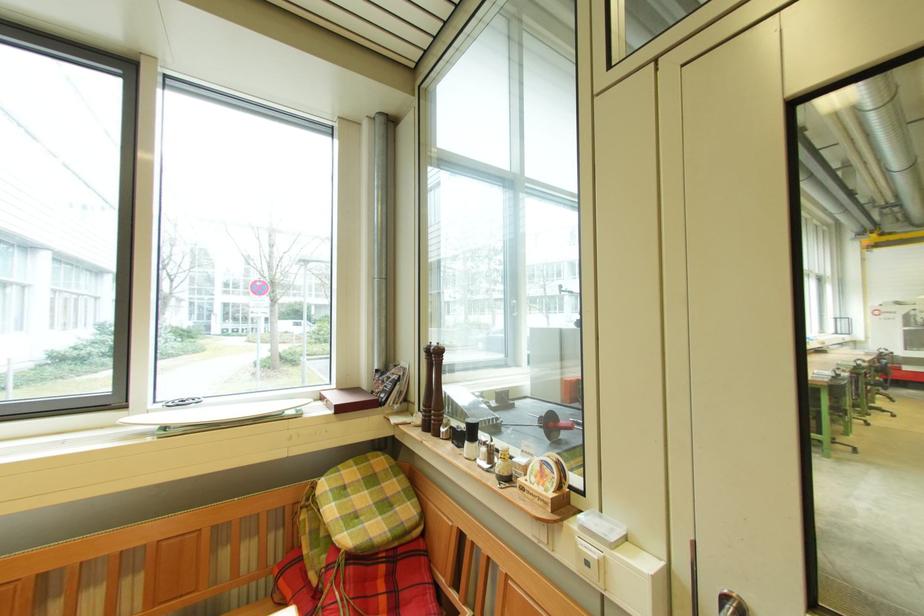
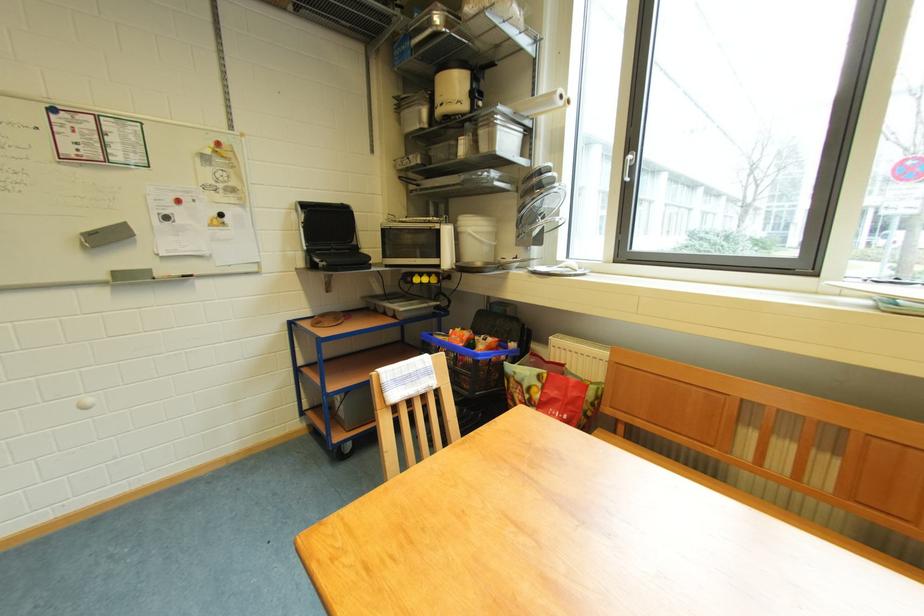
Question: The camera is either moving clockwise (left) or counter-clockwise (right) around the object. The first image is from the beginning of the video and the second image is from the end. Is the camera moving left or right when shooting the video?

Choices:
 (A) Left
 (B) Right

Answer: (B)